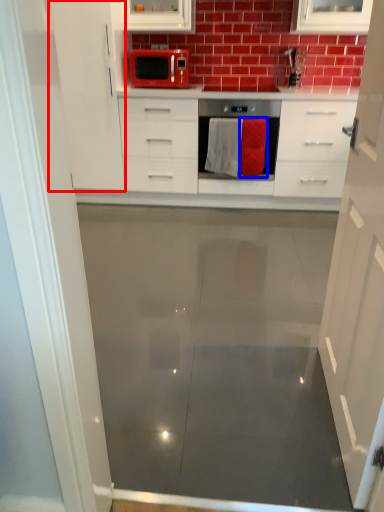
Question: Which object appears farthest to the camera in this image, cabinetry (highlighted by a red box) or material (highlighted by a blue box)?

Choices:
 (A) cabinetry
 (B) material

Answer: (B)